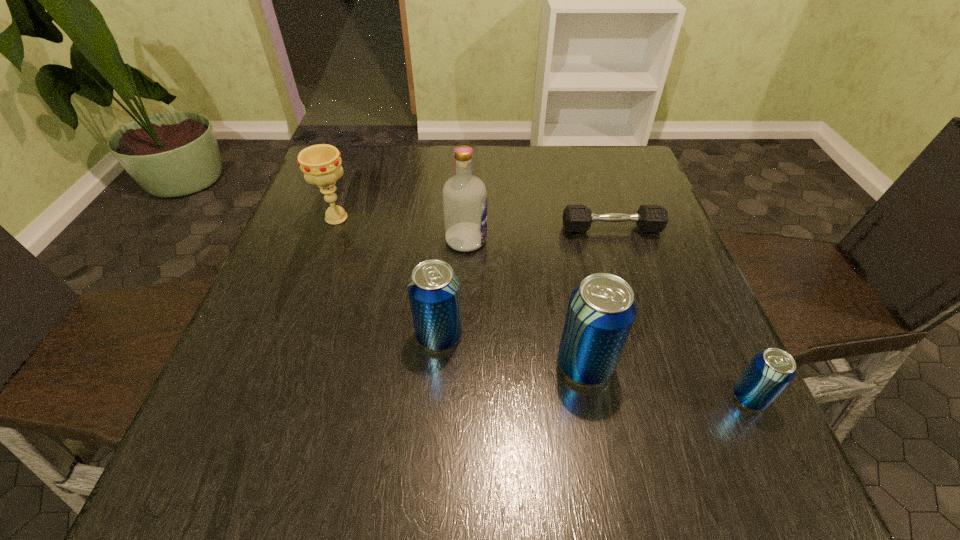
Locate an element on the screen. vacant space at the right edge is located at coordinates (675, 292).

In the image, there is a desktop. What are the coordinates of `free space at the far left corner` in the screenshot? It's located at (355, 181).

Where is `vacant space at the near left corner`? This screenshot has height=540, width=960. vacant space at the near left corner is located at coordinates (289, 424).

Where is `vacant space at the far right corner of the desktop`? vacant space at the far right corner of the desktop is located at coordinates (591, 160).

Find the location of a particular element. The height and width of the screenshot is (540, 960). free spot between the second shortest beer can and the leftmost object is located at coordinates (388, 276).

This screenshot has height=540, width=960. What are the coordinates of `blank region between the second shortest object and the shortest object` in the screenshot? It's located at (680, 313).

This screenshot has height=540, width=960. Identify the location of empty space between the second tallest beer can and the second beer can from left to right. (512, 350).

The image size is (960, 540). In order to click on vacant point located between the second beer can from left to right and the chalice in this screenshot , I will do `click(461, 291)`.

At what (x,y) coordinates should I click in order to perform the action: click on free space that is in between the leftmost beer can and the second beer can from left to right. Please return your answer as a coordinate pair (x, y). Looking at the image, I should click on (512, 350).

Where is `free space between the second beer can from left to right and the chalice`? The height and width of the screenshot is (540, 960). free space between the second beer can from left to right and the chalice is located at coordinates tap(461, 291).